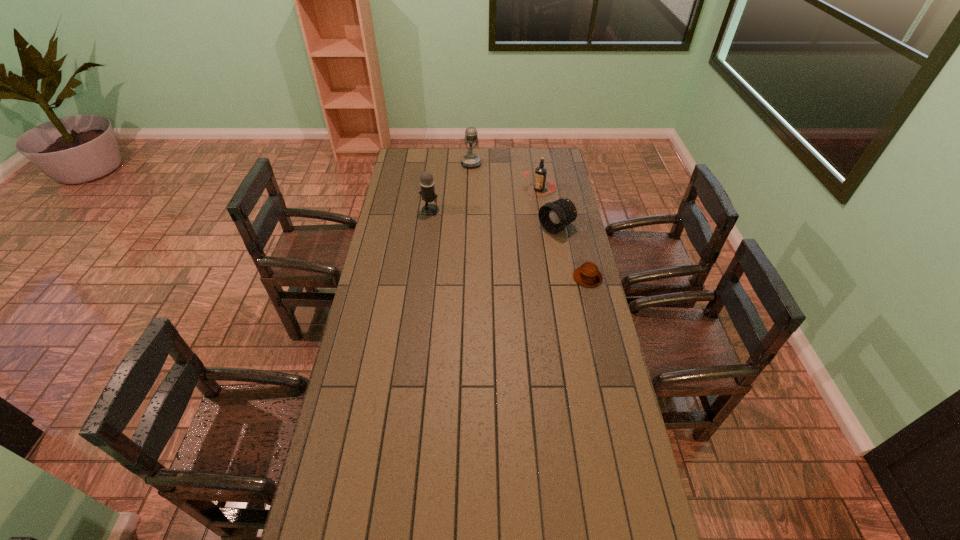
Identify the location of free point between the right microphone and the shortest object. The width and height of the screenshot is (960, 540). (529, 220).

Find the location of a particular element. This screenshot has height=540, width=960. vacant space that's between the root beer and the left microphone is located at coordinates (485, 200).

The width and height of the screenshot is (960, 540). Find the location of `free space between the farther microphone and the shortest object`. free space between the farther microphone and the shortest object is located at coordinates (529, 220).

In order to click on vacant area that lies between the right microphone and the second nearest object in this screenshot , I will do `click(514, 195)`.

What are the coordinates of `unoccupied position between the farther microphone and the third farthest object` in the screenshot? It's located at click(450, 187).

Where is `free space between the leftmost object and the right microphone`? This screenshot has height=540, width=960. free space between the leftmost object and the right microphone is located at coordinates (450, 187).

This screenshot has width=960, height=540. What are the coordinates of `unoccupied area between the muffin and the fourth farthest object` in the screenshot? It's located at point(572,253).

You are a GUI agent. You are given a task and a screenshot of the screen. Output one action in this format:
    pyautogui.click(x=<x>, y=<y>)
    Task: Click on the vacant area that lies between the telephoto lens and the nearest object
    This screenshot has width=960, height=540.
    Given the screenshot: What is the action you would take?
    pyautogui.click(x=572, y=253)

Find the location of a particular element. Image resolution: width=960 pixels, height=540 pixels. vacant region between the second farthest object and the farthest object is located at coordinates (505, 177).

Identify which object is the third nearest to the second shortest object. Please provide its 2D coordinates. Your answer should be formatted as a tuple, i.e. [(x, y)], where the tuple contains the x and y coordinates of a point satisfying the conditions above.

[(427, 192)]